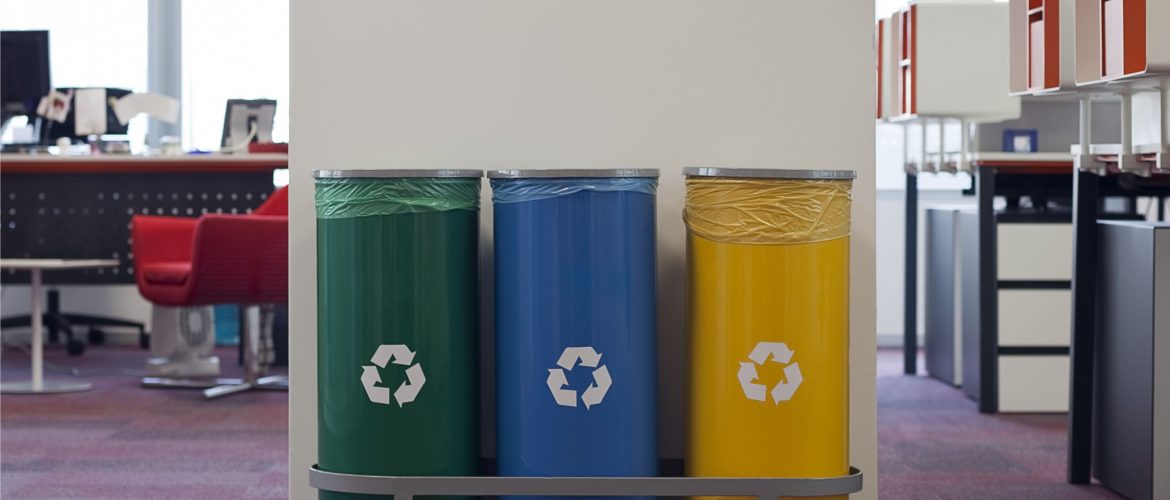
Find the location of `metal pedestal of red chair`. metal pedestal of red chair is located at coordinates tap(249, 346).